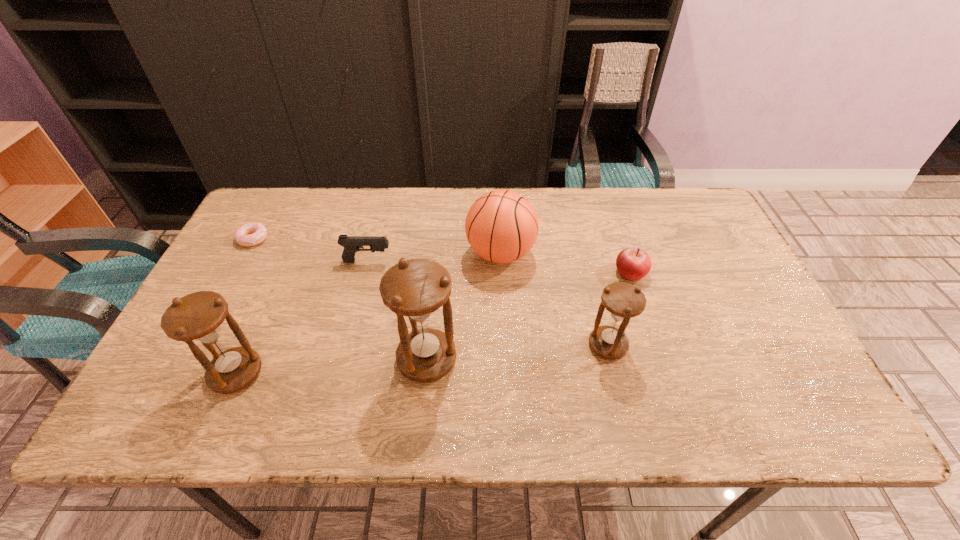
Please point out where to position a new hourglass on the right to maintain spacing. Please provide its 2D coordinates. Your answer should be formatted as a tuple, i.e. [(x, y)], where the tuple contains the x and y coordinates of a point satisfying the conditions above.

[(780, 333)]